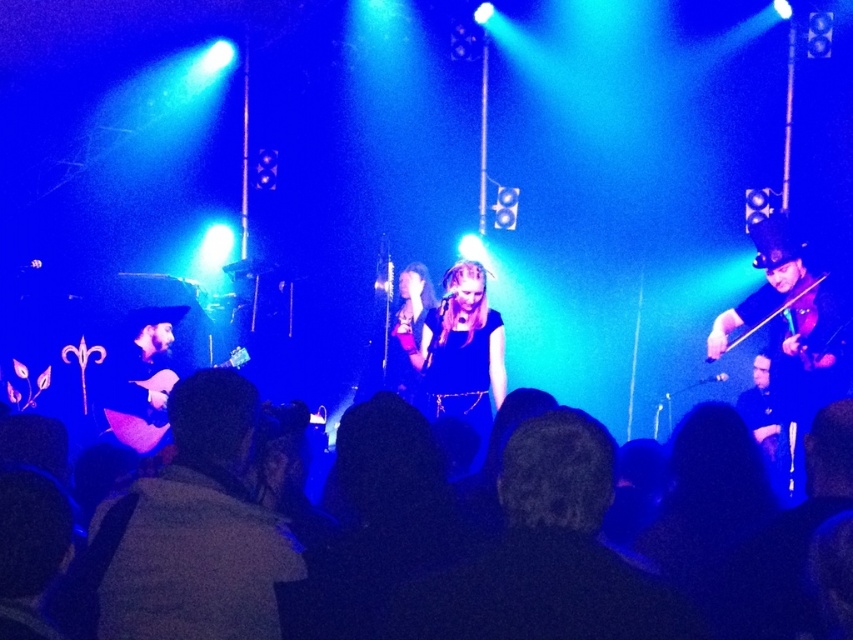
Question: Does dark gray jacket at lower left appear on the right side of shiny black violin at right?

Choices:
 (A) no
 (B) yes

Answer: (A)

Question: Which of the following is the farthest from the observer?

Choices:
 (A) shiny black violin at right
 (B) dark gray jacket at lower left

Answer: (A)

Question: In this image, where is shiny black violin at right located relative to shiny purple guitar at left?

Choices:
 (A) left
 (B) right

Answer: (B)

Question: Which object is the closest to the dark gray jacket at lower left?

Choices:
 (A) shiny purple guitar at left
 (B) shiny black violin at right

Answer: (B)

Question: Which point is farther to the camera?

Choices:
 (A) shiny purple guitar at left
 (B) shiny black violin at right
 (C) dark gray jacket at lower left

Answer: (A)

Question: Is dark gray jacket at lower left wider than shiny purple guitar at left?

Choices:
 (A) no
 (B) yes

Answer: (B)